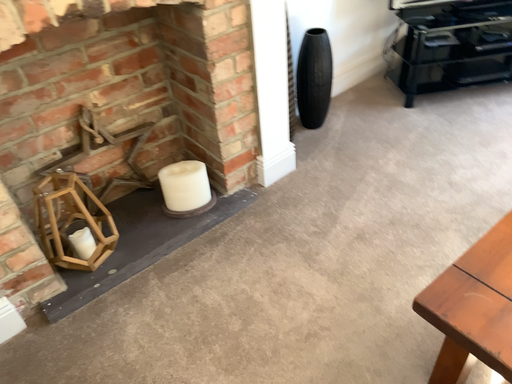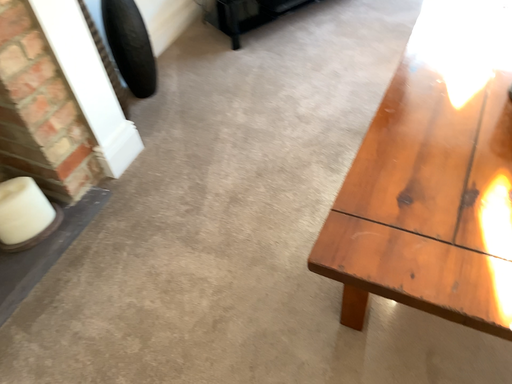
Question: How did the camera likely rotate when shooting the video?

Choices:
 (A) rotated right
 (B) rotated left

Answer: (A)